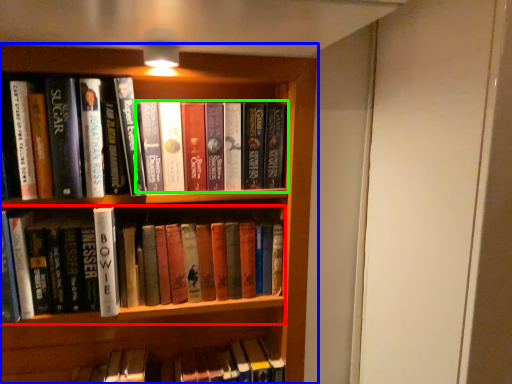
Question: Based on their relative distances, which object is nearer to book (highlighted by a red box)? Choose from bookcase (highlighted by a blue box) and book (highlighted by a green box).

Choices:
 (A) bookcase
 (B) book

Answer: (B)